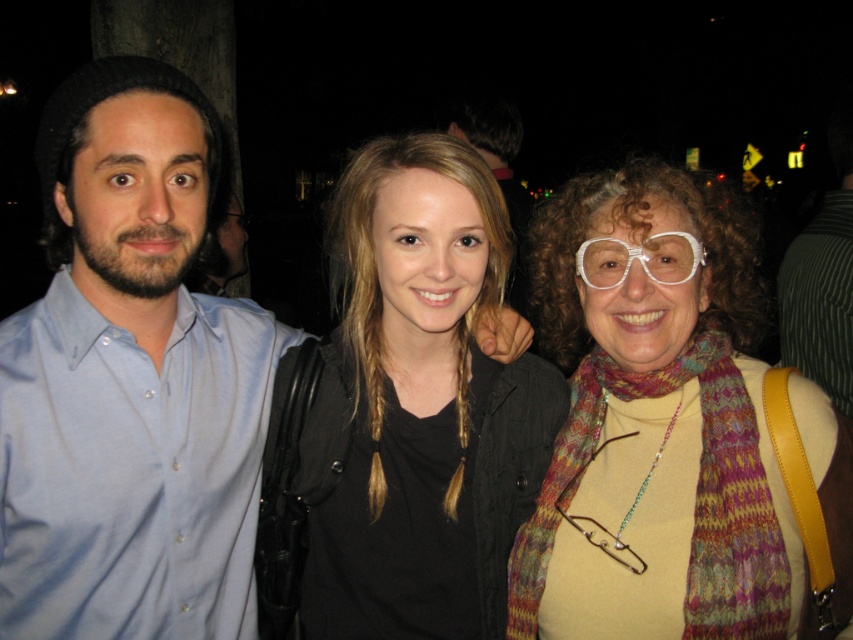
Question: Which point is closer to the camera taking this photo?

Choices:
 (A) (129, 244)
 (B) (495, 97)

Answer: (A)

Question: Does knitted scarf at right appear over metallic wire glasses at center?

Choices:
 (A) yes
 (B) no

Answer: (A)

Question: Among these objects, which one is nearest to the camera?

Choices:
 (A) white plastic glasses at center
 (B) knitted scarf at right
 (C) matte blue shirt at left

Answer: (B)

Question: Does light blue shirt at left have a lesser width compared to black matte jacket at center?

Choices:
 (A) no
 (B) yes

Answer: (B)

Question: Does light blue shirt at left have a smaller size compared to black matte jacket at center?

Choices:
 (A) yes
 (B) no

Answer: (A)

Question: Considering the real-world distances, which object is farthest from the metallic wire glasses at center?

Choices:
 (A) knitted scarf at right
 (B) black matte jacket at center
 (C) matte blue shirt at left
 (D) light blue shirt at left

Answer: (C)